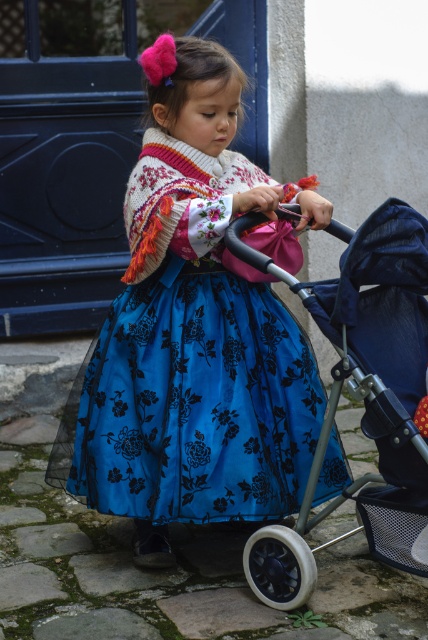
Question: Which object appears farthest from the camera in this image?

Choices:
 (A) metallic gray stroller at center
 (B) blue satin dress at center

Answer: (B)

Question: Which point is farther from the camera taking this photo?

Choices:
 (A) (401, 388)
 (B) (137, 163)

Answer: (B)

Question: Can you confirm if blue satin dress at center is positioned to the left of metallic gray stroller at center?

Choices:
 (A) yes
 (B) no

Answer: (A)

Question: Which object is farther from the camera taking this photo?

Choices:
 (A) blue satin dress at center
 (B) metallic gray stroller at center

Answer: (A)

Question: Can you confirm if blue satin dress at center is thinner than metallic gray stroller at center?

Choices:
 (A) no
 (B) yes

Answer: (A)

Question: Can you confirm if blue satin dress at center is positioned to the right of metallic gray stroller at center?

Choices:
 (A) yes
 (B) no

Answer: (B)